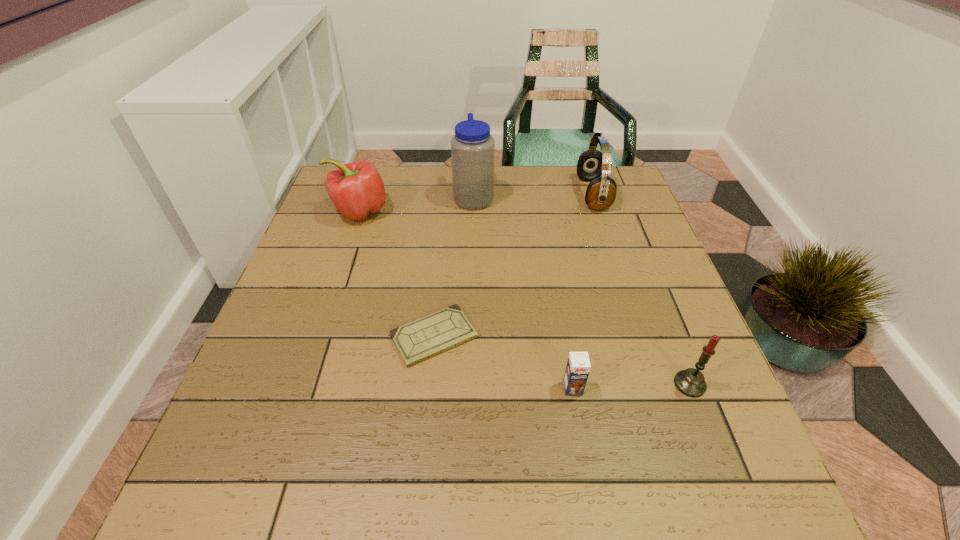
At what (x,y) coordinates should I click in order to perform the action: click on vacant space that satisfies the following two spatial constraints: 1. on the ear cups of the candle; 2. on the left side of the headset. Please return your answer as a coordinate pair (x, y). This screenshot has width=960, height=540. Looking at the image, I should click on (655, 384).

The height and width of the screenshot is (540, 960). I want to click on free space that satisfies the following two spatial constraints: 1. on the ear cups of the headset; 2. on the back side of the candle, so click(655, 384).